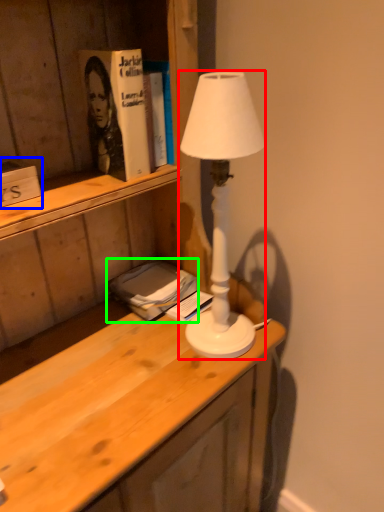
Question: Estimate the real-world distances between objects in this image. Which object is closer to lamp (highlighted by a red box), book (highlighted by a blue box) or book (highlighted by a green box)?

Choices:
 (A) book
 (B) book

Answer: (B)